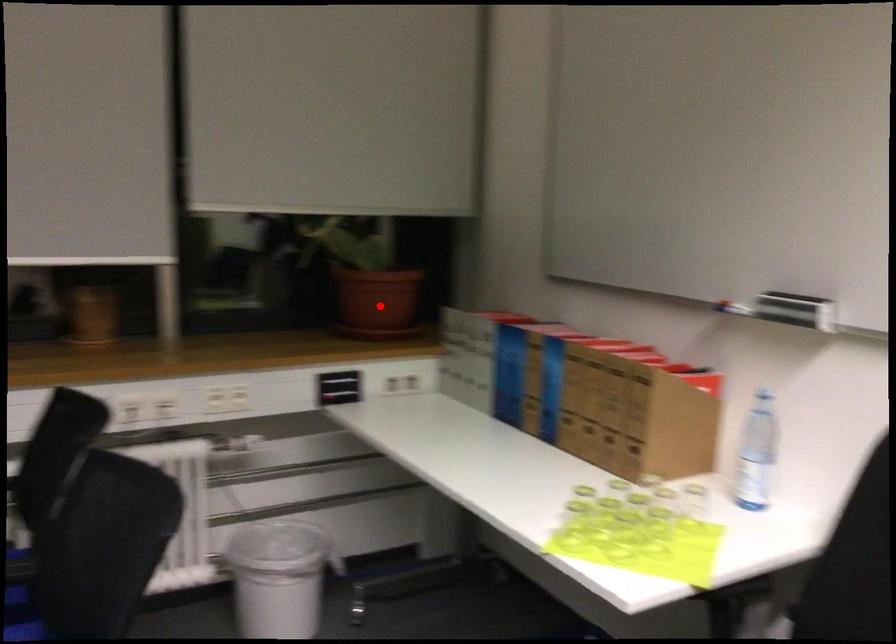
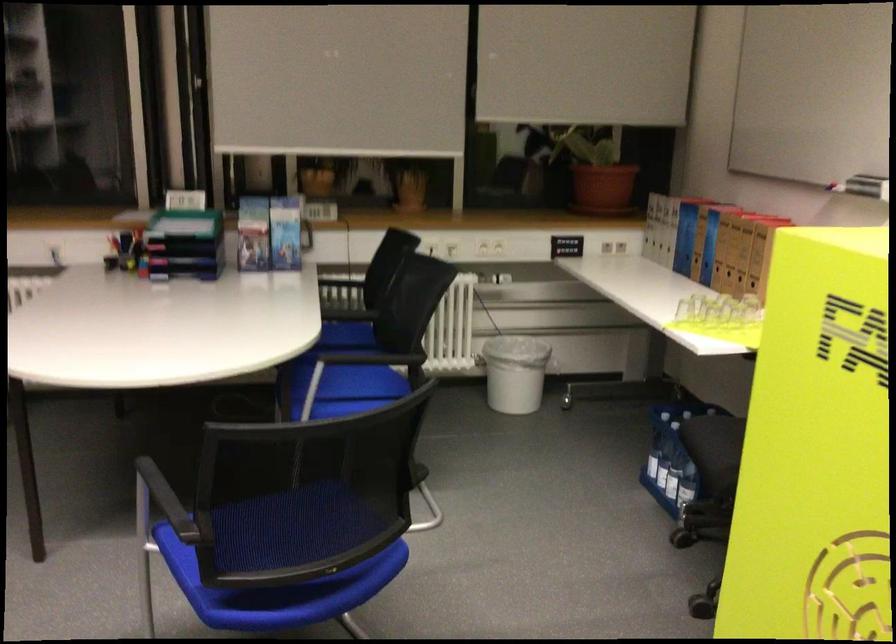
Question: I am providing you with two images of the same scene from different viewpoints. In image1, a red point is highlighted. Considering the same 3D point in image2, which of the following is correct?

Choices:
 (A) It is closer
 (B) It is farther

Answer: (B)